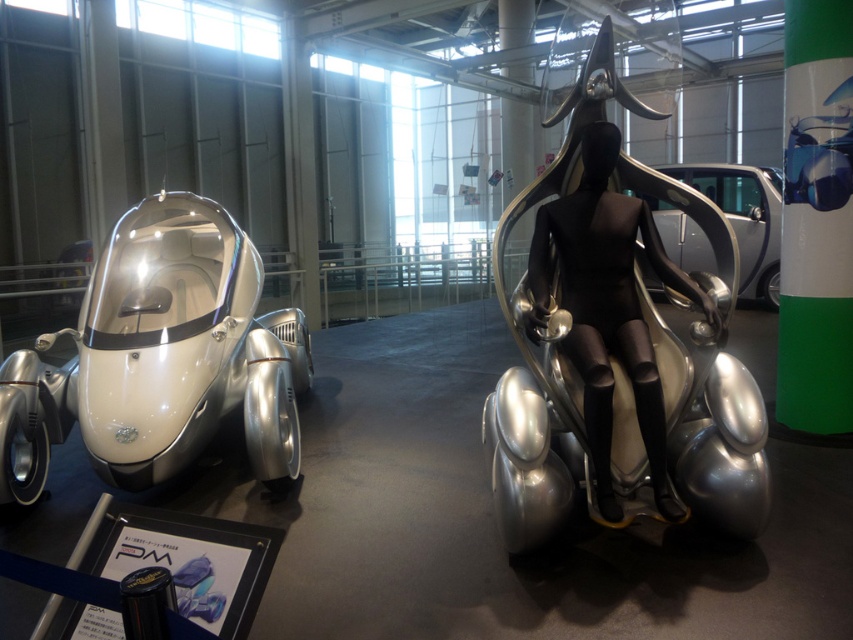
Can you confirm if silver metallic chair at center is positioned below silver metallic concept car at left?

No.

Does silver metallic chair at center have a larger size compared to silver metallic concept car at left?

Incorrect, silver metallic chair at center is not larger than silver metallic concept car at left.

This screenshot has height=640, width=853. Describe the element at coordinates (618, 346) in the screenshot. I see `silver metallic chair at center` at that location.

At what (x,y) coordinates should I click in order to perform the action: click on silver metallic chair at center. Please return your answer as a coordinate pair (x, y). The width and height of the screenshot is (853, 640). Looking at the image, I should click on (618, 346).

Which is more to the left, silver metallic concept car at left or metallic silver car at center?

From the viewer's perspective, silver metallic concept car at left appears more on the left side.

Can you confirm if silver metallic concept car at left is taller than metallic silver car at center?

No.

Is point (207, 380) positioned before point (715, 170)?

Yes.

Identify the location of silver metallic concept car at left. (160, 358).

Can you confirm if silver metallic chair at center is positioned to the left of metallic silver car at center?

Correct, you'll find silver metallic chair at center to the left of metallic silver car at center.

Image resolution: width=853 pixels, height=640 pixels. I want to click on silver metallic chair at center, so click(x=618, y=346).